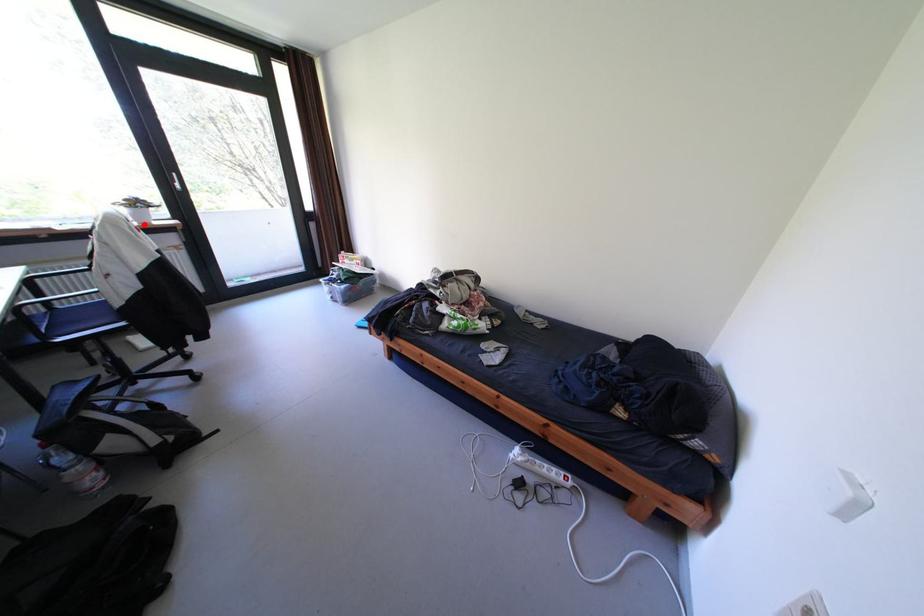
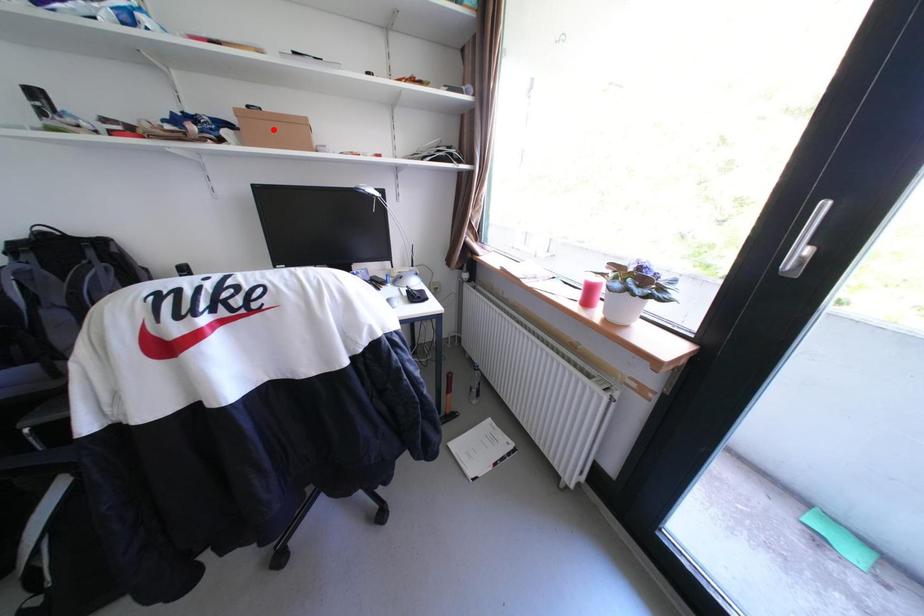
I am providing you with two images of the same scene from different viewpoints. A red point is marked on the first image and another point is marked on the second image. Is the red point in image1 aligned with the point shown in image2?

No